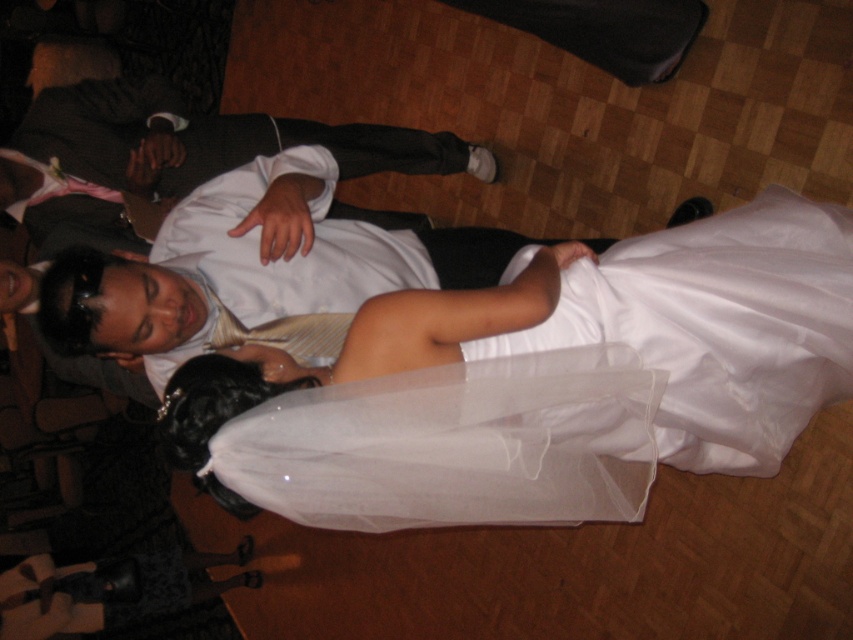
You are a photographer at a wedding reception. You need to capture a photo of the white sheer dress at center and the white satin shirt at center. Since the camera has a limited frame, you want to know which one is wider so you can adjust the focus accordingly. Which object is wider?

The white sheer dress at center is wider than the white satin shirt at center, so you should adjust the focus to accommodate its width.

What are the coordinates of the white sheer dress at center?

The white sheer dress at center is located at point (579, 388).

You are a photographer at the wedding reception. You notice the white sheer dress at center and the white satin shirt at center. Which one is closer to the camera?

The white sheer dress at center is in front of the white satin shirt at center, so it is closer to the camera.